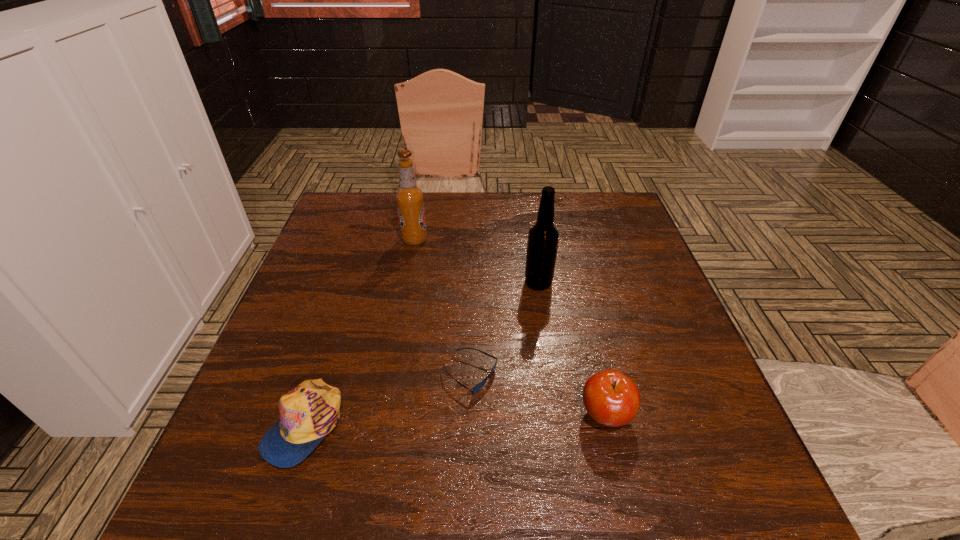
The image size is (960, 540). In the image, there is a desktop. Find the location of `vacant space at the right edge`. vacant space at the right edge is located at coordinates (649, 280).

In the image, there is a desktop. In order to click on vacant space at the near left corner in this screenshot , I will do `click(281, 523)`.

Identify the location of blank space at the far right corner of the desktop. The height and width of the screenshot is (540, 960). (616, 199).

What are the coordinates of `vacant space that is in between the leftmost object and the third tallest object` in the screenshot? It's located at (455, 420).

Find the location of a particular element. This screenshot has width=960, height=540. vacant area that lies between the leftmost object and the third tallest object is located at coordinates (455, 420).

Image resolution: width=960 pixels, height=540 pixels. I want to click on free space between the shortest object and the farther beer bottle, so click(x=443, y=308).

Identify the location of free space between the right beer bottle and the apple. (572, 349).

You are a GUI agent. You are given a task and a screenshot of the screen. Output one action in this format:
    pyautogui.click(x=<x>, y=<y>)
    Task: Click on the empty space between the third object from right to left and the second shortest object
    
    Given the screenshot: What is the action you would take?
    (387, 400)

The width and height of the screenshot is (960, 540). I want to click on free space between the third shortest object and the shortest object, so click(538, 395).

You are a GUI agent. You are given a task and a screenshot of the screen. Output one action in this format:
    pyautogui.click(x=<x>, y=<y>)
    Task: Click on the empty location between the apple and the sunglasses
    This screenshot has width=960, height=540.
    Given the screenshot: What is the action you would take?
    pyautogui.click(x=538, y=395)